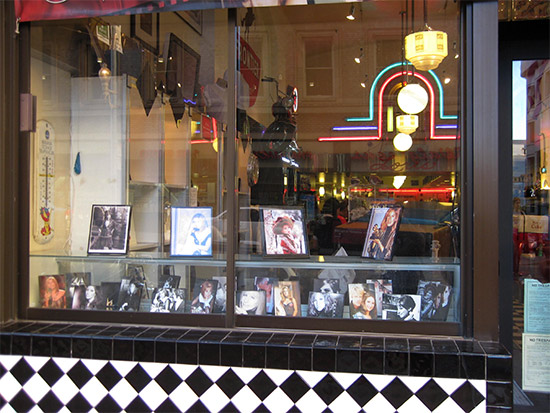
What are the coordinates of `lamp` in the screenshot? It's located at (432, 62), (402, 127).